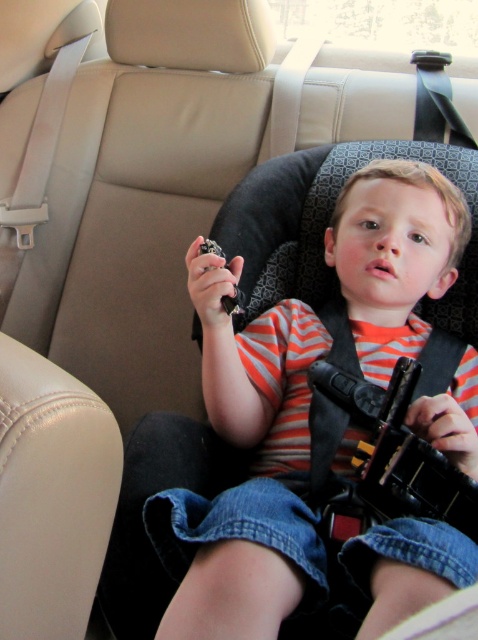
You are a safety inspector checking the car seat. You notice a point at coordinates (249, 477). According to the image, where is this point located?

The point at coordinates (249, 477) is located on the striped cotton shirt at center.

Based on the photo, you are a safety inspector checking the car seat. You notice the striped cotton shirt at center and the black plastic toy gun at center. Which item is wider?

The striped cotton shirt at center is wider than the black plastic toy gun at center.

You are a safety inspector checking the car seat installation. You notice two points marked at coordinates point (260, 317) and point (325, 493). Which point is closer to the back of the car?

Point (260, 317) is behind point (325, 493), so it is closer to the back of the car.